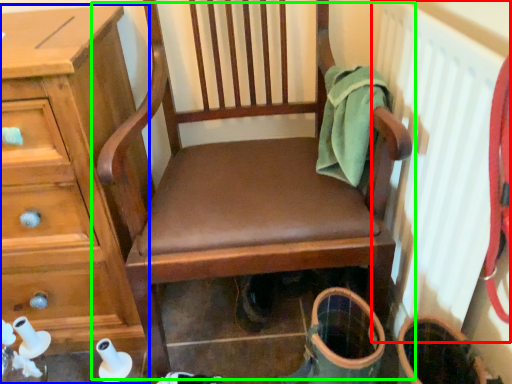
Question: Which is farther away from radiator (highlighted by a red box)? chest of drawers (highlighted by a blue box) or chair (highlighted by a green box)?

Choices:
 (A) chest of drawers
 (B) chair

Answer: (A)